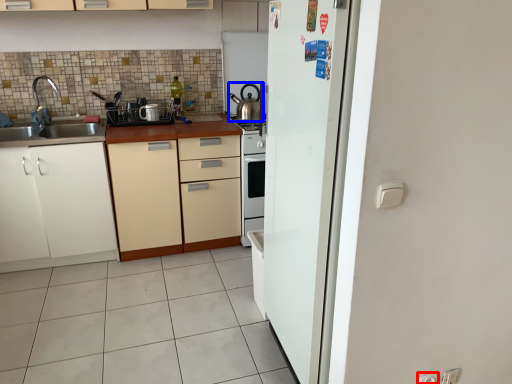
Question: Which of the following is the farthest to the observer, electric outlet (highlighted by a red box) or kitchen appliance (highlighted by a blue box)?

Choices:
 (A) electric outlet
 (B) kitchen appliance

Answer: (B)